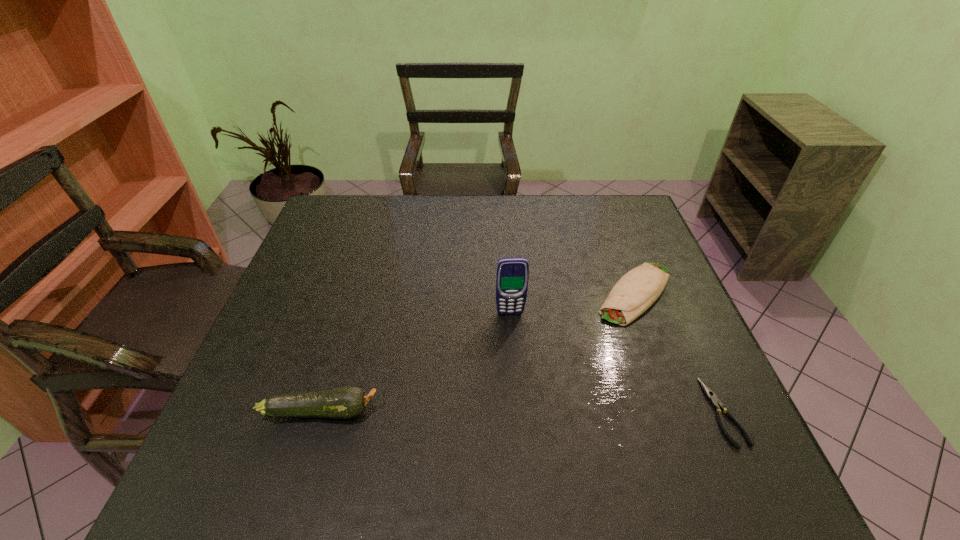
What are the coordinates of `free space between the leftmost object and the cellular telephone` in the screenshot? It's located at (416, 362).

Identify the location of free space between the burrito and the third object from right to left. The height and width of the screenshot is (540, 960). (572, 303).

This screenshot has width=960, height=540. Find the location of `unoccupied area between the cellular telephone and the second shortest object`. unoccupied area between the cellular telephone and the second shortest object is located at coordinates click(572, 303).

Locate an element on the screen. free space between the shortest object and the third tallest object is located at coordinates (680, 352).

You are a GUI agent. You are given a task and a screenshot of the screen. Output one action in this format:
    pyautogui.click(x=<x>, y=<y>)
    Task: Click on the unoccupied position between the leftmost object and the burrito
    Image resolution: width=960 pixels, height=540 pixels.
    Given the screenshot: What is the action you would take?
    pyautogui.click(x=478, y=352)

You are a GUI agent. You are given a task and a screenshot of the screen. Output one action in this format:
    pyautogui.click(x=<x>, y=<y>)
    Task: Click on the free space between the second object from left to right and the pliers
    Image resolution: width=960 pixels, height=540 pixels.
    Given the screenshot: What is the action you would take?
    pyautogui.click(x=617, y=363)

Choose which object is the second nearest neighbor to the cellular telephone. Please provide its 2D coordinates. Your answer should be formatted as a tuple, i.e. [(x, y)], where the tuple contains the x and y coordinates of a point satisfying the conditions above.

[(345, 402)]

Identify which object is located as the nearest to the shortest object. Please provide its 2D coordinates. Your answer should be formatted as a tuple, i.e. [(x, y)], where the tuple contains the x and y coordinates of a point satisfying the conditions above.

[(638, 289)]

Find the location of a particular element. The image size is (960, 540). vacant space that satisfies the following two spatial constraints: 1. on the front side of the pliers; 2. on the left side of the burrito is located at coordinates (680, 412).